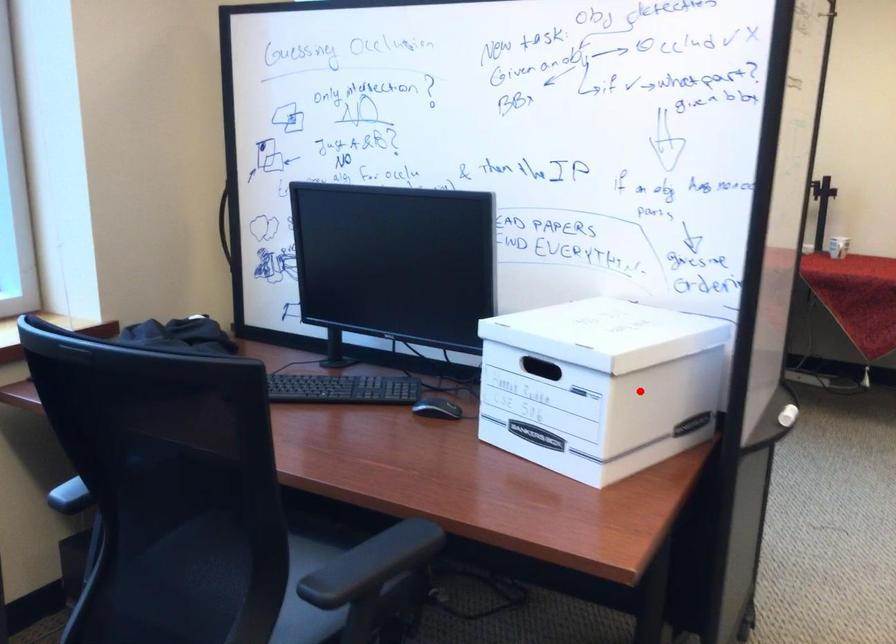
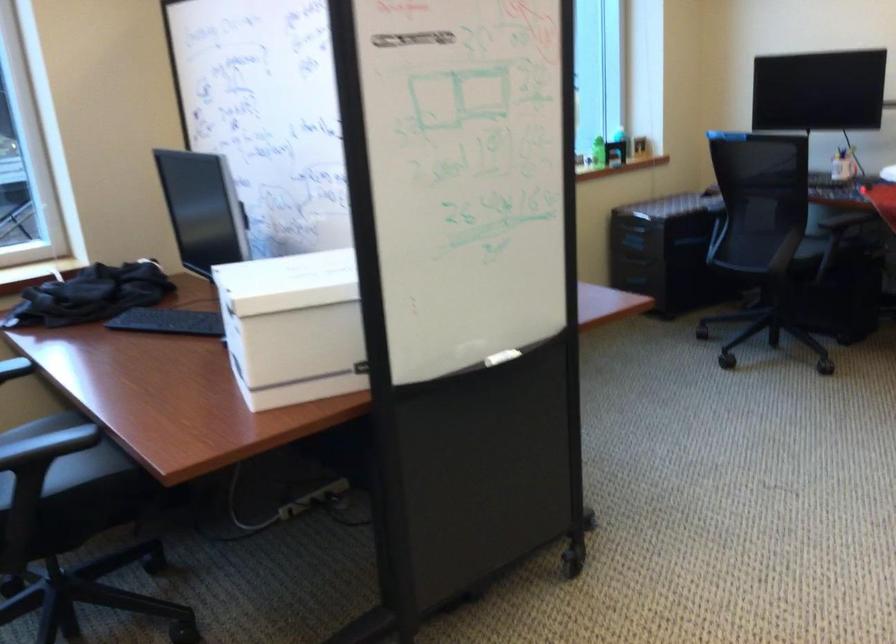
Find the pixel in the second image that matches the highlighted location in the first image.

(293, 327)